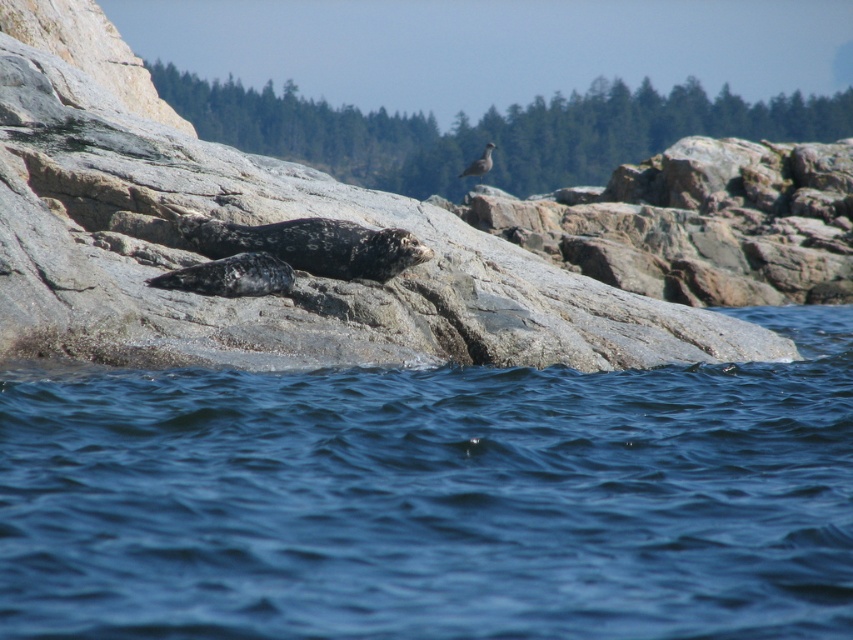
Is point (91, 266) farther from camera compared to point (485, 170)?

No, it is not.

Is smooth gray rock at center positioned before gray feathered bird at upper center?

Yes, smooth gray rock at center is closer to the viewer.

Is point (358, 301) closer to viewer compared to point (483, 154)?

Yes, point (358, 301) is in front of point (483, 154).

The height and width of the screenshot is (640, 853). In order to click on smooth gray rock at center in this screenshot , I will do `click(376, 228)`.

Does point (555, 614) come closer to viewer compared to point (494, 145)?

Yes, point (555, 614) is closer to viewer.

Is blue water at lower center wider than gray feathered bird at upper center?

Yes.

Does point (729, 442) come in front of point (476, 164)?

Yes, point (729, 442) is in front of point (476, 164).

Locate an element on the screen. The image size is (853, 640). blue water at lower center is located at coordinates (434, 499).

Can you confirm if blue water at lower center is positioned below smooth gray rock at center?

Yes, blue water at lower center is below smooth gray rock at center.

Is point (814, 451) less distant than point (201, 317)?

Yes, it is in front of point (201, 317).

The height and width of the screenshot is (640, 853). I want to click on blue water at lower center, so click(434, 499).